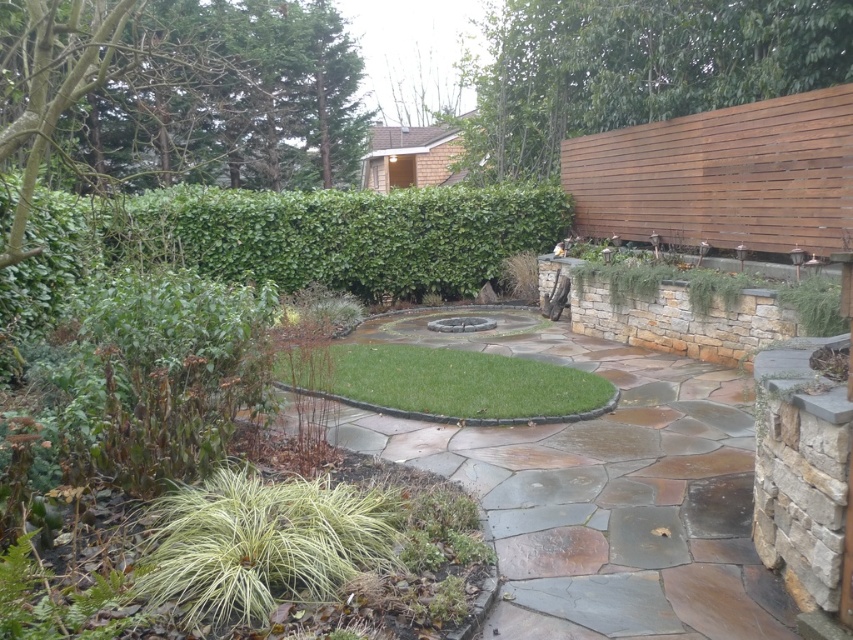
You are designing a garden layout and need to ensure proper visibility between the green leafy hedge at center and the green grass at lower left. Since the hedge is taller, which object might block the view of the other when standing at the lower left side?

The green leafy hedge at center is taller than the green grass at lower left, so when standing at the lower left side, the green leafy hedge at center might block the view of the green grass at lower left.

You are planning to walk through the garden and want to know which area is bigger between the green stone path at center and the green leafy hedge at center. Which one is larger?

The green stone path at center is larger in size than the green leafy hedge at center according to the description provided.

You are standing at the entrance of the garden and see the green stone path at center. If you want to walk to the point with coordinates 0.767, 0.706, where should you walk towards?

The green stone path at center is located at the coordinates (601,490), so you should walk towards it.